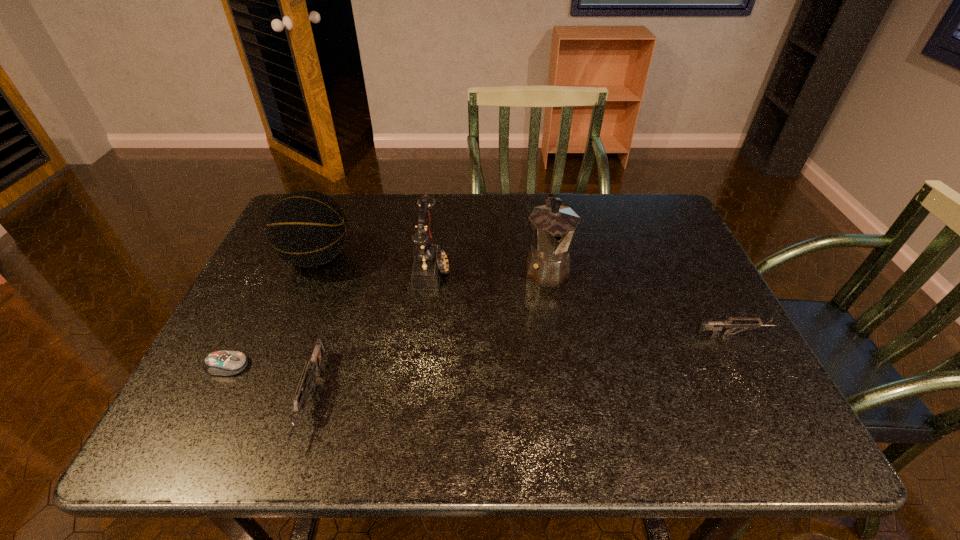
Locate an element on the screen. The width and height of the screenshot is (960, 540). free spot that satisfies the following two spatial constraints: 1. on the dial of the telephone; 2. aimed along the barrel of the third shortest object is located at coordinates (417, 397).